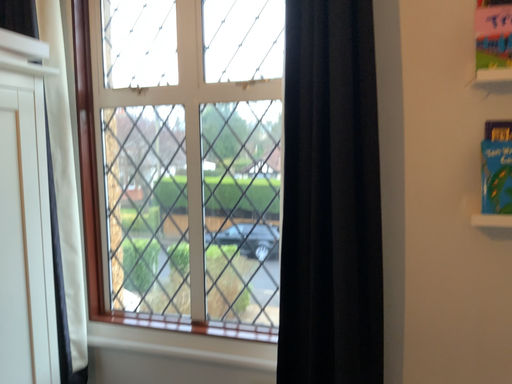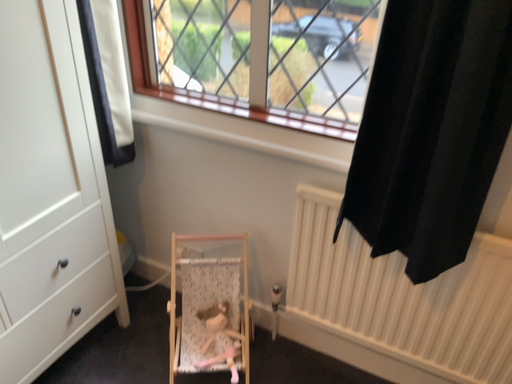
Question: Which way did the camera rotate in the video?

Choices:
 (A) rotated right
 (B) rotated left

Answer: (B)